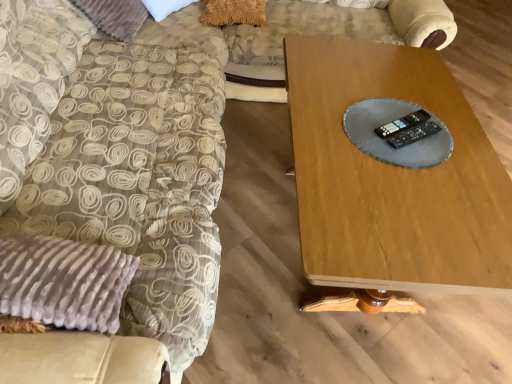
This screenshot has height=384, width=512. I want to click on vacant area on top of wooden table at center (from a real-world perspective), so click(396, 132).